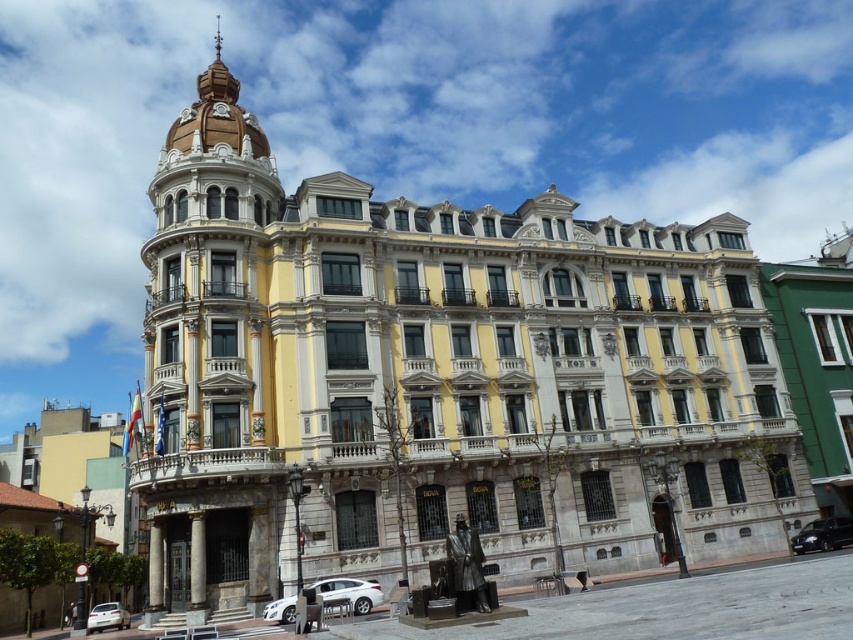
Can you confirm if white matte car at lower left is bigger than gold textured clock at upper center?

Correct, white matte car at lower left is larger in size than gold textured clock at upper center.

What do you see at coordinates (107, 616) in the screenshot? I see `white matte car at lower left` at bounding box center [107, 616].

Is point (103, 608) closer to camera compared to point (212, 106)?

Yes, point (103, 608) is closer to viewer.

Locate an element on the screen. white matte car at lower left is located at coordinates (107, 616).

Who is taller, white glossy car at center or gold textured clock at upper center?

With more height is gold textured clock at upper center.

Can you confirm if white glossy car at center is smaller than gold textured clock at upper center?

Yes.

Between point (346, 586) and point (215, 115), which one is positioned behind?

The point (215, 115) is more distant.

Locate an element on the screen. This screenshot has height=640, width=853. white glossy car at center is located at coordinates (350, 593).

Which is more to the right, white glossy car at center or silver metallic clock at upper center?

white glossy car at center is more to the right.

Locate an element on the screen. The image size is (853, 640). white glossy car at center is located at coordinates (350, 593).

Is point (340, 588) closer to viewer compared to point (190, 108)?

Yes, it is.

Locate an element on the screen. This screenshot has height=640, width=853. white glossy car at center is located at coordinates (350, 593).